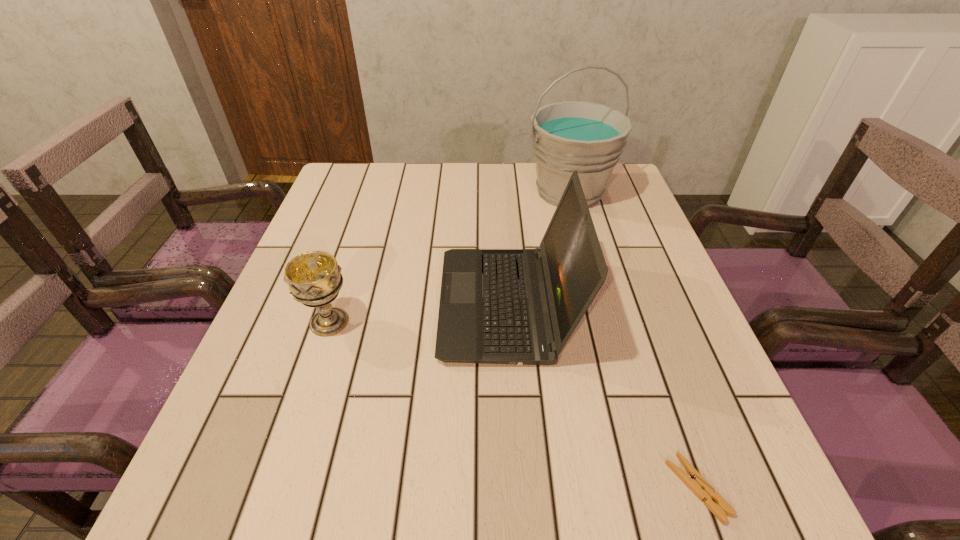
The image size is (960, 540). Find the location of `vacant space at the far edge of the desktop`. vacant space at the far edge of the desktop is located at coordinates (474, 205).

The image size is (960, 540). I want to click on free region at the near edge of the desktop, so click(508, 483).

Identify the location of vacant space at the left edge of the desktop. (352, 210).

Image resolution: width=960 pixels, height=540 pixels. I want to click on vacant area at the right edge of the desktop, so click(618, 223).

Where is `vacant space at the far left corner`? vacant space at the far left corner is located at coordinates tap(369, 173).

Find the location of a particular element. The image size is (960, 540). vacant space at the far right corner is located at coordinates (629, 194).

Where is `unoccupied position between the nearest object and the leftmost object`? Image resolution: width=960 pixels, height=540 pixels. unoccupied position between the nearest object and the leftmost object is located at coordinates (514, 405).

Identify the location of empty space between the laptop_computer and the shortest object. This screenshot has width=960, height=540. (602, 396).

This screenshot has height=540, width=960. I want to click on free space between the leftmost object and the laptop_computer, so click(418, 313).

This screenshot has height=540, width=960. Find the location of `free space between the chalice and the laptop_computer`. free space between the chalice and the laptop_computer is located at coordinates (418, 313).